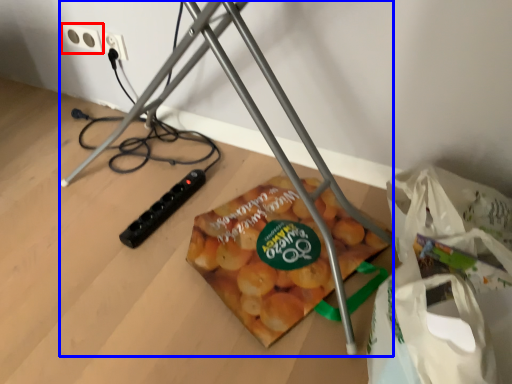
Question: Which of the following is the closest to the observer, power plugs and sockets (highlighted by a red box) or tripod (highlighted by a blue box)?

Choices:
 (A) power plugs and sockets
 (B) tripod

Answer: (B)